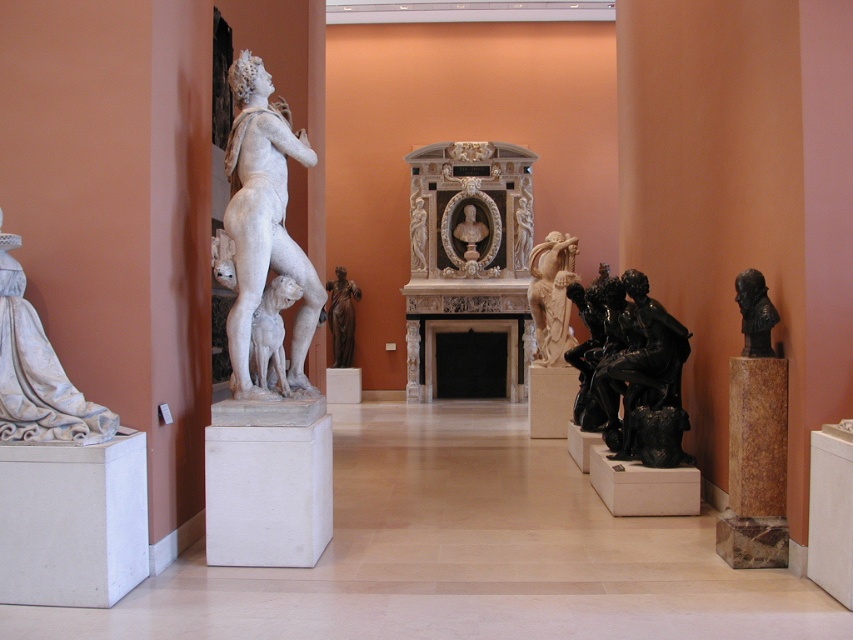
You are an art curator planning to move the black marble bust at right closer to the entrance. To do this, you need to determine if there is a clear path around the white marble statue at left. Based on the scene description, can you move the bust around the statue?

The black marble bust at right is currently behind the white marble statue at left, so there is likely a clear path around the statue to move it closer to the entrance.